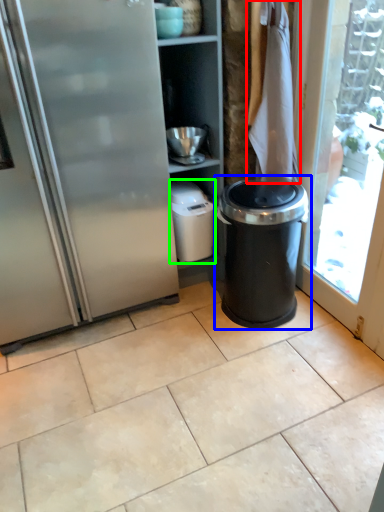
Question: Which object is the farthest from laundry (highlighted by a red box)? Choose among these: waste container (highlighted by a blue box) or appliance (highlighted by a green box).

Choices:
 (A) waste container
 (B) appliance

Answer: (B)